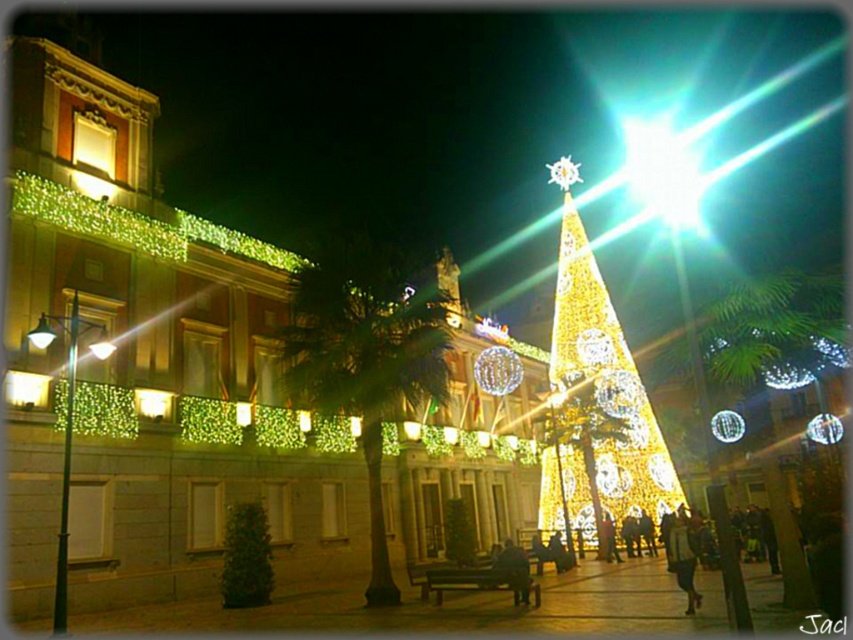
You are standing in the festive nighttime scene and want to take a photo of both the green leafy palm tree at center and the illuminated gold christmas tree at center. Which tree should you position yourself to the right of to capture both in the frame?

You should position yourself to the right of the green leafy palm tree at center because it is on the left side of the illuminated gold christmas tree at center, allowing both to be captured in the frame when positioned correctly.

Consider the image. You are standing at the center of the festive scene and see the point marked at coordinates [364,365]. What object is located at this point?

The point at coordinates [364,365] indicates a green leafy palm tree at center.

You are at the festive nighttime scene and want to take a photo of both the green leafy palm tree at center and the illuminated gold christmas tree at center. Which tree should you focus on first if you want to capture both in one frame without moving the camera?

You should focus on the illuminated gold christmas tree at center first because it is taller than the green leafy palm tree at center, ensuring it fits within the frame when centered.